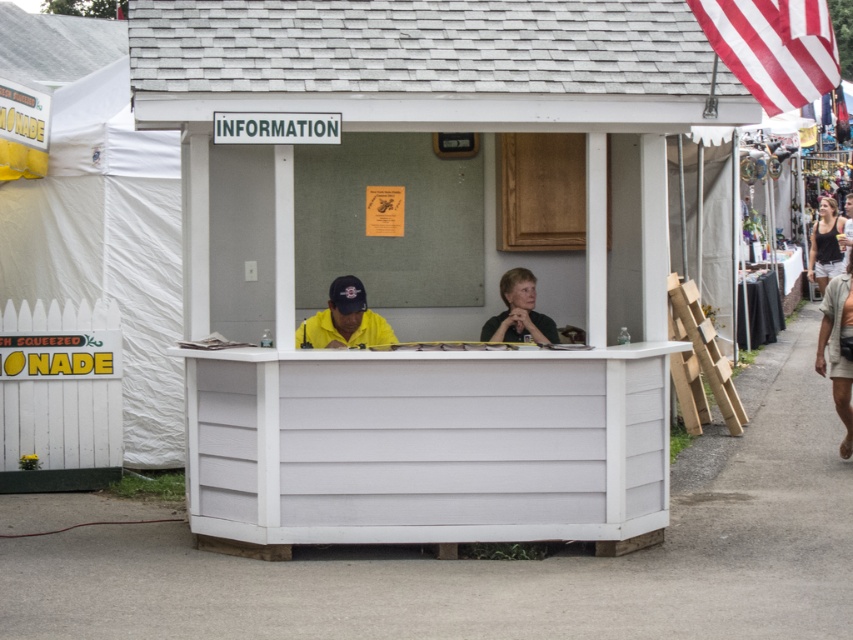
Question: Which object is closer to the camera taking this photo?

Choices:
 (A) white wood information booth at center
 (B) yellow matte shirt at center
 (C) matte black tank top at right

Answer: (A)

Question: Does denim shorts at right appear on the left side of matte black tank top at right?

Choices:
 (A) yes
 (B) no

Answer: (A)

Question: Can you confirm if yellow matte shirt at center is smaller than black matte shirt at center?

Choices:
 (A) yes
 (B) no

Answer: (A)

Question: Which object appears farthest from the camera in this image?

Choices:
 (A) yellow matte shirt at center
 (B) white wood information booth at center

Answer: (A)

Question: Which of the following is the farthest from the observer?

Choices:
 (A) black matte shirt at center
 (B) yellow matte shirt at center
 (C) denim shorts at right

Answer: (C)

Question: Does white wood information booth at center come behind black matte shirt at center?

Choices:
 (A) yes
 (B) no

Answer: (B)